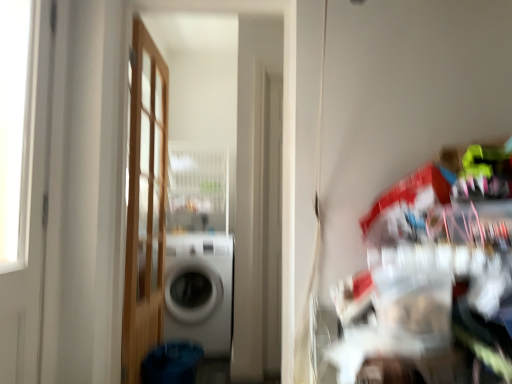
Question: From a real-world perspective, is wooden door at left, which ranks as the 2th door in left-to-right order, above or below white glossy washing machine at center?

Choices:
 (A) above
 (B) below

Answer: (A)

Question: Considering the positions of wooden door at left, the 1th door from the right, and white glossy washing machine at center in the image, is wooden door at left, the 1th door from the right, bigger or smaller than white glossy washing machine at center?

Choices:
 (A) small
 (B) big

Answer: (A)

Question: Which of these objects is positioned farthest from the white glossy door at left, the 2th door from the back?

Choices:
 (A) wooden door at left, the 1th door from the right
 (B) white glossy washing machine at center

Answer: (B)

Question: Considering the real-world distances, which object is farthest from the white glossy washing machine at center?

Choices:
 (A) wooden door at left, the 1th door from the right
 (B) white glossy door at left, placed as the second door when sorted from right to left

Answer: (B)